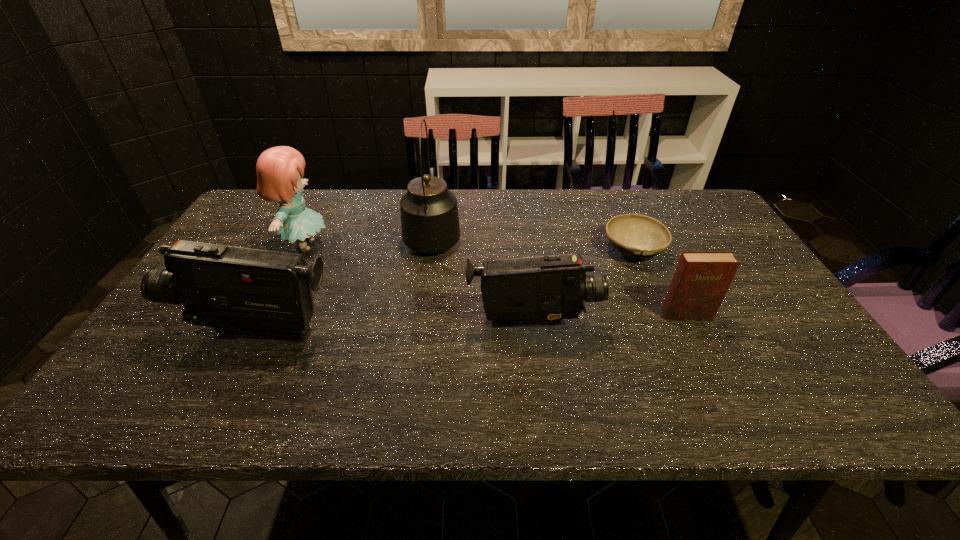
This screenshot has height=540, width=960. I want to click on vacant space in between the shorter camcorder and the diary, so (610, 319).

Locate an element on the screen. empty space between the shortest object and the left camcorder is located at coordinates (446, 291).

Find the location of a particular element. This screenshot has height=540, width=960. free spot between the diary and the third object from right to left is located at coordinates (610, 319).

Identify the location of vacant space that's between the diary and the left camcorder. (472, 323).

Locate which object is the closest to the fourth object from left to right. Please provide its 2D coordinates. Your answer should be formatted as a tuple, i.e. [(x, y)], where the tuple contains the x and y coordinates of a point satisfying the conditions above.

[(701, 280)]

Locate an element on the screen. The image size is (960, 540). object that stands as the fifth closest to the bowl is located at coordinates (279, 169).

You are a GUI agent. You are given a task and a screenshot of the screen. Output one action in this format:
    pyautogui.click(x=<x>, y=<y>)
    Task: Click on the vacant space that satisfies the following two spatial constraints: 1. on the front-facing side of the doll; 2. on the left side of the shortest object
    
    Given the screenshot: What is the action you would take?
    pyautogui.click(x=303, y=250)

Image resolution: width=960 pixels, height=540 pixels. I want to click on vacant space that satisfies the following two spatial constraints: 1. on the front cover of the diary; 2. on the front-facing side of the left camcorder, so click(695, 332).

Where is `vacant space that satisfies the following two spatial constraints: 1. on the front cover of the diary; 2. on the front-facing side of the left camcorder`? vacant space that satisfies the following two spatial constraints: 1. on the front cover of the diary; 2. on the front-facing side of the left camcorder is located at coordinates (695, 332).

Locate an element on the screen. This screenshot has height=540, width=960. free location that satisfies the following two spatial constraints: 1. on the front-facing side of the doll; 2. on the right side of the bowl is located at coordinates (303, 250).